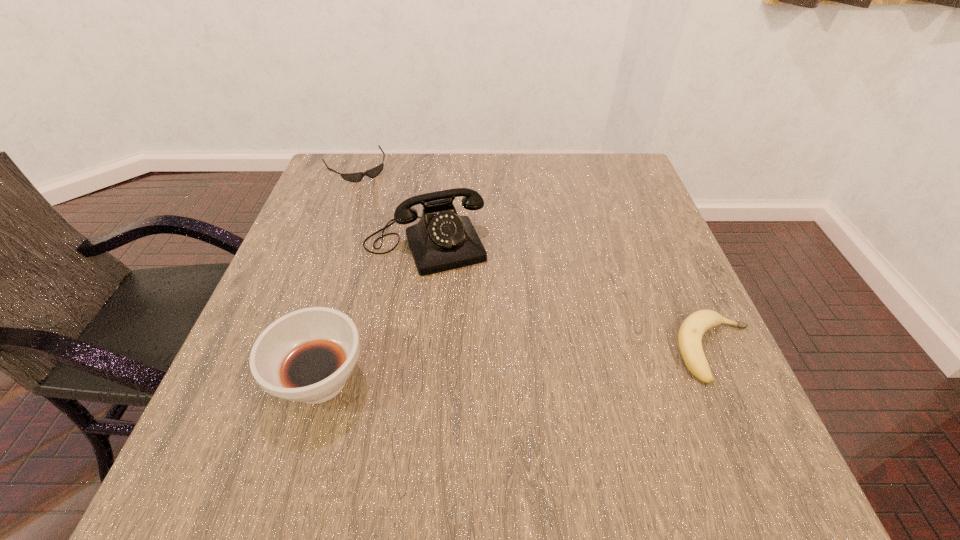
Where is `the second tallest object`? the second tallest object is located at coordinates (307, 355).

In order to click on the third tallest object in this screenshot , I will do `click(692, 329)`.

What are the coordinates of `the rightmost object` in the screenshot? It's located at (692, 329).

Identify the location of sunglasses. (372, 173).

Where is `the farthest object`? the farthest object is located at coordinates (372, 173).

You are a GUI agent. You are given a task and a screenshot of the screen. Output one action in this format:
    pyautogui.click(x=<x>, y=<y>)
    Task: Click on the second farthest object
    The height and width of the screenshot is (540, 960).
    Given the screenshot: What is the action you would take?
    pyautogui.click(x=442, y=240)

Identify the location of the tallest object. (442, 240).

This screenshot has width=960, height=540. Identify the location of free region located on the back of the soup bowl. (341, 309).

Where is `blank area located 0.250m on the back of the second shortest object`? Image resolution: width=960 pixels, height=540 pixels. blank area located 0.250m on the back of the second shortest object is located at coordinates (664, 237).

Find the location of a particular element. free space located on the front-facing side of the shortest object is located at coordinates (374, 196).